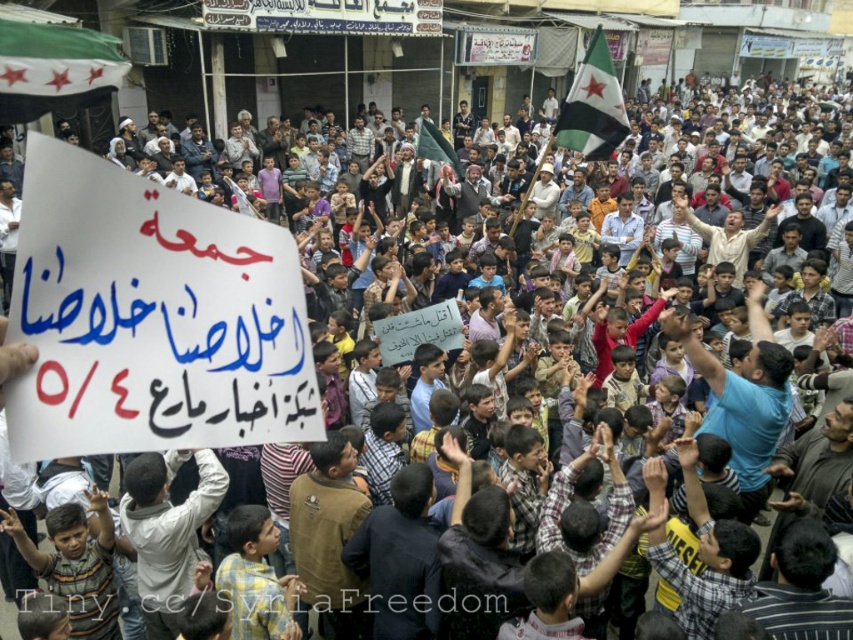
Question: Can you confirm if white fabric flag at upper left is bigger than green and white fabric flag at upper center?

Choices:
 (A) no
 (B) yes

Answer: (A)

Question: Does white fabric flag at upper left have a lesser width compared to green and white fabric flag at upper center?

Choices:
 (A) yes
 (B) no

Answer: (A)

Question: Which point is farther from the camera taking this photo?

Choices:
 (A) (4, 32)
 (B) (589, 102)

Answer: (B)

Question: Can you confirm if white fabric flag at upper left is wider than green and white fabric flag at upper center?

Choices:
 (A) yes
 (B) no

Answer: (B)

Question: Which point is closer to the camera?

Choices:
 (A) (599, 156)
 (B) (61, 83)

Answer: (B)